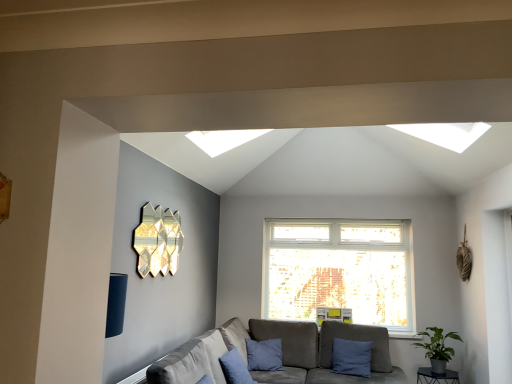
Question: In terms of width, does blue cotton pillow at lower center, positioned as the first pillow in front-to-back order, look wider or thinner when compared to gray fabric couch at lower center?

Choices:
 (A) thin
 (B) wide

Answer: (A)

Question: From a real-world perspective, relative to gray fabric couch at lower center, is blue cotton pillow at lower center, positioned as the 2th pillow in right-to-left order, vertically above or below?

Choices:
 (A) below
 (B) above

Answer: (B)

Question: Which object is the closest to the green matte plant at lower right?

Choices:
 (A) metallic black table at lower right
 (B) blue cotton pillow at lower center, positioned as the 2th pillow in right-to-left order
 (C) gray fabric couch at lower center
 (D) blue fabric pillow at lower right, which is the second pillow in front-to-back order
 (E) gold metallic wall art at upper left

Answer: (A)

Question: Based on their relative distances, which object is farther from the blue fabric pillow at lower right, arranged as the first pillow when viewed from the back?

Choices:
 (A) blue cotton pillow at lower center, positioned as the 2th pillow in right-to-left order
 (B) metallic black table at lower right
 (C) gray fabric couch at lower center
 (D) green matte plant at lower right
 (E) gold metallic wall art at upper left

Answer: (E)